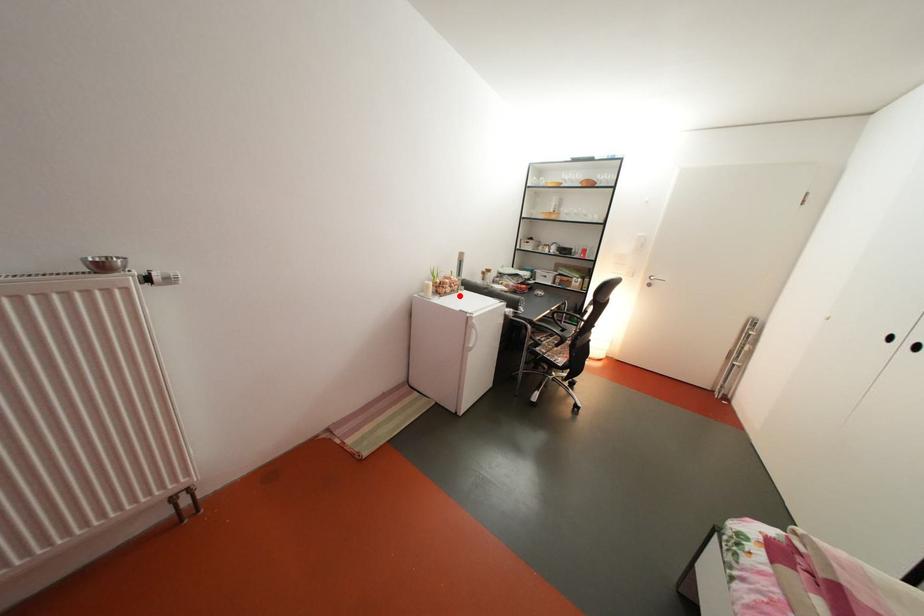
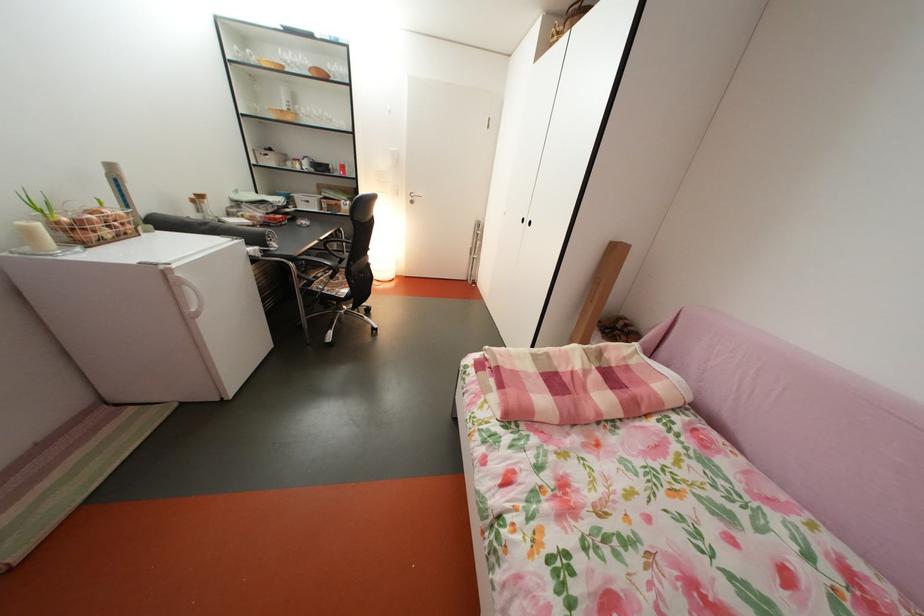
In the second image, find the point that corresponds to the highlighted location in the first image.

(118, 238)